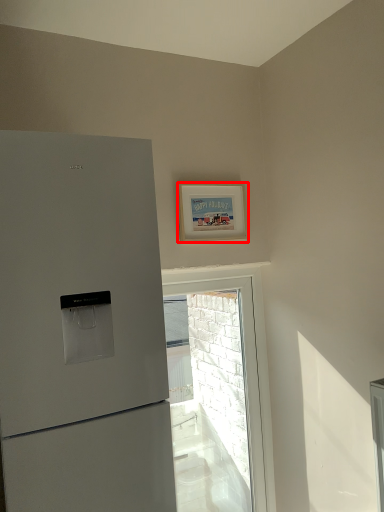
Question: From the image's perspective, where is picture frame (annotated by the red box) located relative to window?

Choices:
 (A) below
 (B) above

Answer: (B)